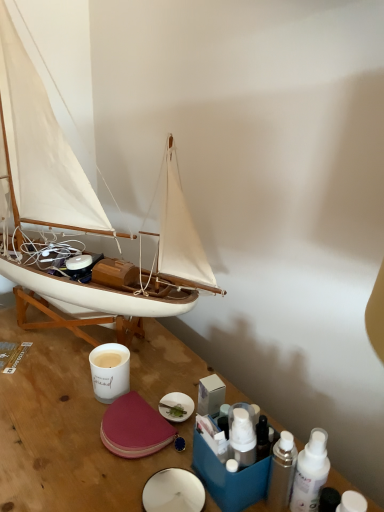
Question: Considering the relative sizes of metallic silver spray can at lower right, the 2th toiletry in the left-to-right sequence, and metallic silver spray can at lower right, positioned as the 3th toiletry in right-to-left order, in the image provided, is metallic silver spray can at lower right, the 2th toiletry in the left-to-right sequence, taller than metallic silver spray can at lower right, positioned as the 3th toiletry in right-to-left order,?

Choices:
 (A) no
 (B) yes

Answer: (B)

Question: From the image's perspective, is metallic silver spray can at lower right, the 2th toiletry in the left-to-right sequence, under metallic silver spray can at lower right, which is the first toiletry from left to right?

Choices:
 (A) no
 (B) yes

Answer: (A)

Question: Does metallic silver spray can at lower right, the 2th toiletry in the left-to-right sequence, have a lesser width compared to metallic silver spray can at lower right, positioned as the 3th toiletry in right-to-left order?

Choices:
 (A) yes
 (B) no

Answer: (B)

Question: Are metallic silver spray can at lower right, the 2th toiletry in the left-to-right sequence, and metallic silver spray can at lower right, positioned as the 3th toiletry in right-to-left order, making contact?

Choices:
 (A) yes
 (B) no

Answer: (A)

Question: Does metallic silver spray can at lower right, the 2th toiletry in the left-to-right sequence, have a lesser height compared to metallic silver spray can at lower right, which is the first toiletry from left to right?

Choices:
 (A) yes
 (B) no

Answer: (B)

Question: Is metallic silver spray can at lower right, which is the first toiletry from left to right, surrounded by metallic silver spray can at lower right, the 2th toiletry in the left-to-right sequence?

Choices:
 (A) no
 (B) yes

Answer: (A)

Question: Is white matte sailboat at left wider than white matte bottle at lower right, which appears as the 3th toiletry when viewed from the left?

Choices:
 (A) yes
 (B) no

Answer: (A)

Question: From the image's perspective, does white matte sailboat at left appear higher than white matte bottle at lower right, which appears as the 3th toiletry when viewed from the left?

Choices:
 (A) yes
 (B) no

Answer: (A)

Question: Is white matte bottle at lower right, marked as the first toiletry in a right-to-left arrangement, at the back of white matte sailboat at left?

Choices:
 (A) no
 (B) yes

Answer: (A)

Question: Would you say white matte sailboat at left is a long distance from white matte bottle at lower right, marked as the first toiletry in a right-to-left arrangement?

Choices:
 (A) yes
 (B) no

Answer: (B)

Question: From a real-world perspective, is white matte sailboat at left located beneath white matte bottle at lower right, marked as the first toiletry in a right-to-left arrangement?

Choices:
 (A) yes
 (B) no

Answer: (B)

Question: Can you confirm if white matte sailboat at left is positioned to the left of white matte bottle at lower right, marked as the first toiletry in a right-to-left arrangement?

Choices:
 (A) yes
 (B) no

Answer: (A)

Question: From the image's perspective, is white matte bottle at lower right, marked as the first toiletry in a right-to-left arrangement, located beneath white matte sailboat at left?

Choices:
 (A) yes
 (B) no

Answer: (A)